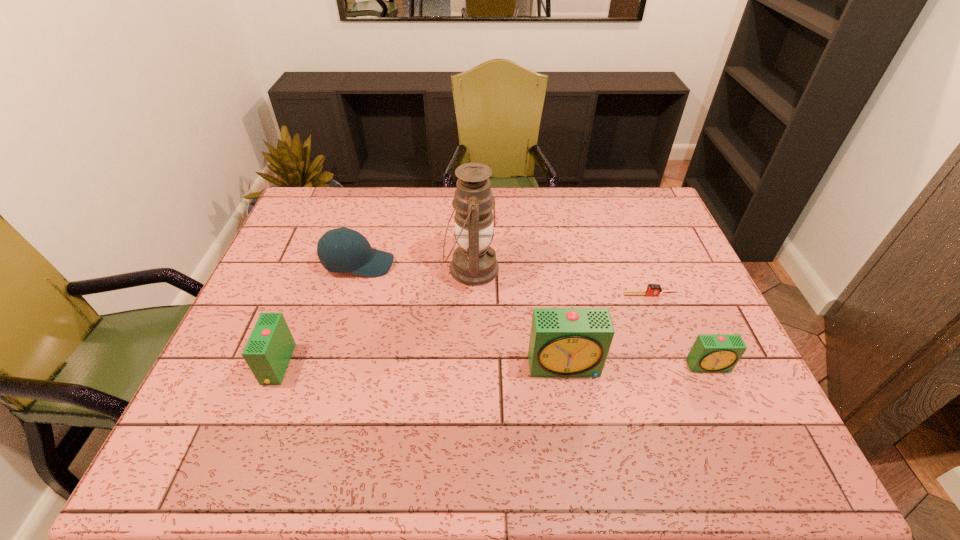
At what (x,y) coordinates should I click in order to perform the action: click on unoccupied area between the rightmost alarm clock and the second alarm clock from right to left. Please return your answer as a coordinate pair (x, y). Looking at the image, I should click on (637, 366).

Image resolution: width=960 pixels, height=540 pixels. I want to click on free area in between the shortest alarm clock and the shortest object, so click(x=680, y=330).

Find the location of a particular element. The height and width of the screenshot is (540, 960). free point between the third object from left to right and the second shortest alarm clock is located at coordinates (374, 316).

Find the location of a particular element. free space between the second shortest alarm clock and the second alarm clock from left to right is located at coordinates (421, 365).

Identify the location of object that is the fifth closest one to the tape measure. (268, 351).

Locate which object is the third closest to the tallest object. Please provide its 2D coordinates. Your answer should be formatted as a tuple, i.e. [(x, y)], where the tuple contains the x and y coordinates of a point satisfying the conditions above.

[(652, 289)]

In order to click on alarm clock that is the closest to the fifth tallest object in this screenshot , I will do [x=564, y=342].

You are a GUI agent. You are given a task and a screenshot of the screen. Output one action in this format:
    pyautogui.click(x=<x>, y=<y>)
    Task: Click on the alarm clock that is the third closest one to the oil lamp
    This screenshot has height=540, width=960.
    Given the screenshot: What is the action you would take?
    pyautogui.click(x=711, y=353)

This screenshot has width=960, height=540. What are the coordinates of `blank area in the image that satisfies the following two spatial constraints: 1. on the front side of the fourth object from right to left; 2. on the front-facing side of the leftmost alarm clock` in the screenshot? It's located at (469, 364).

Locate an element on the screen. The width and height of the screenshot is (960, 540). vacant space that satisfies the following two spatial constraints: 1. on the front side of the tallest object; 2. on the front-facing side of the second shortest alarm clock is located at coordinates (469, 364).